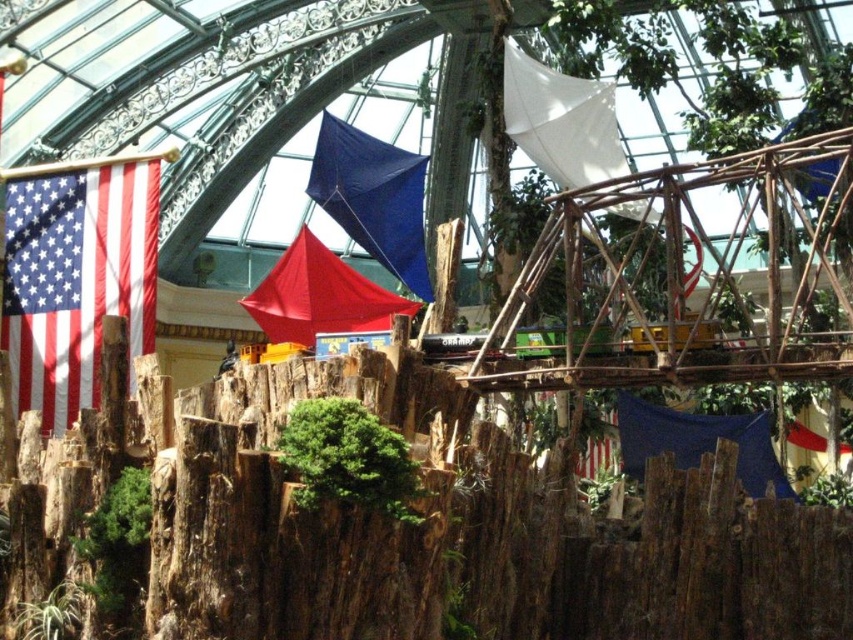
You are standing in the greenhouse and want to hang a new flag between the matte fabric flag at left and the white fabric flag at upper center. Based on their positions, which flag should you place the new flag closer to?

The new flag should be placed closer to the white fabric flag at upper center since the matte fabric flag at left is already positioned to its left.

You are standing in the greenhouse and want to place a new decorative flag at the exact center of the image. However, there is already a blue fabric kite at center located at point coordinates of 0.311, 0.438. Can you place your new flag at the true center of the image without overlapping the kite?

The blue fabric kite at center is already located at the exact center coordinates of the image, so placing a new flag there would cause overlap. Therefore, you cannot place the flag at the true center without overlapping the kite.